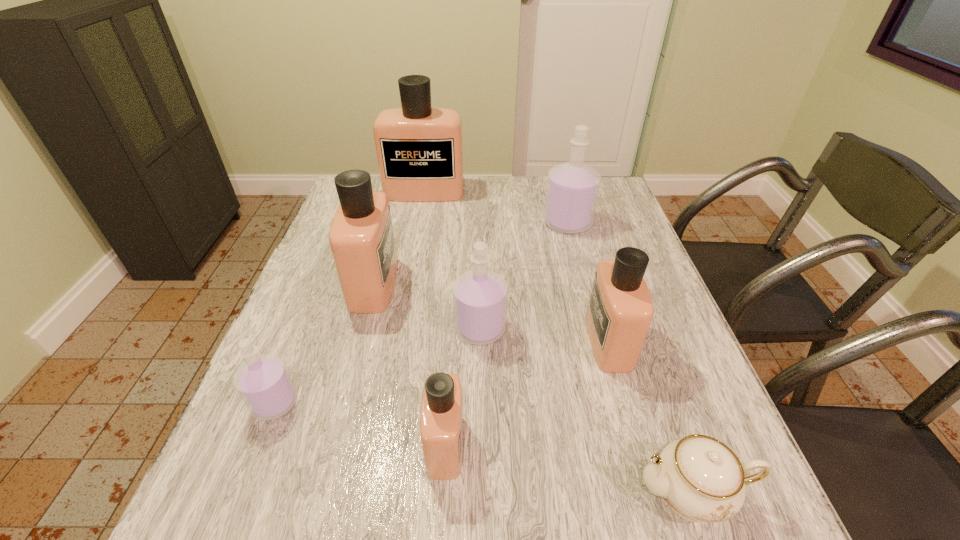
At what (x,y) coordinates should I click in order to perform the action: click on vacant region at the left edge of the desktop. Please return your answer as a coordinate pair (x, y). The width and height of the screenshot is (960, 540). Looking at the image, I should click on (287, 359).

Locate an element on the screen. free region at the right edge is located at coordinates (634, 388).

Where is `vacant area between the third biggest beige perfume and the biggest purple perfume`? The image size is (960, 540). vacant area between the third biggest beige perfume and the biggest purple perfume is located at coordinates (588, 282).

Image resolution: width=960 pixels, height=540 pixels. What are the coordinates of `free spot between the second farthest purple perfume and the second farthest object` in the screenshot? It's located at click(524, 276).

The image size is (960, 540). What are the coordinates of `free space that is in between the farthest purple perfume and the third smallest beige perfume` in the screenshot? It's located at (470, 253).

I want to click on free spot between the rightmost purple perfume and the rightmost beige perfume, so click(x=588, y=282).

You are a GUI agent. You are given a task and a screenshot of the screen. Output one action in this format:
    pyautogui.click(x=<x>, y=<y>)
    Task: Click on the free space between the nearest beige perfume and the biggest beige perfume
    
    Given the screenshot: What is the action you would take?
    pyautogui.click(x=435, y=318)

I want to click on free space between the rightmost purple perfume and the leftmost purple perfume, so click(421, 313).

Find the location of a particular element. The image size is (960, 540). vacant area between the sixth nearest perfume and the smallest beige perfume is located at coordinates (507, 334).

The height and width of the screenshot is (540, 960). What are the coordinates of `empty space between the farthest purple perfume and the third biggest beige perfume` in the screenshot? It's located at click(x=588, y=282).